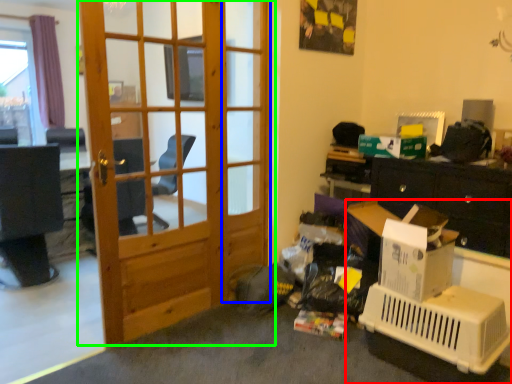
Question: Considering the real-world distances, which object is farthest from desk (highlighted by a red box)? screen door (highlighted by a blue box) or door (highlighted by a green box)?

Choices:
 (A) screen door
 (B) door

Answer: (B)